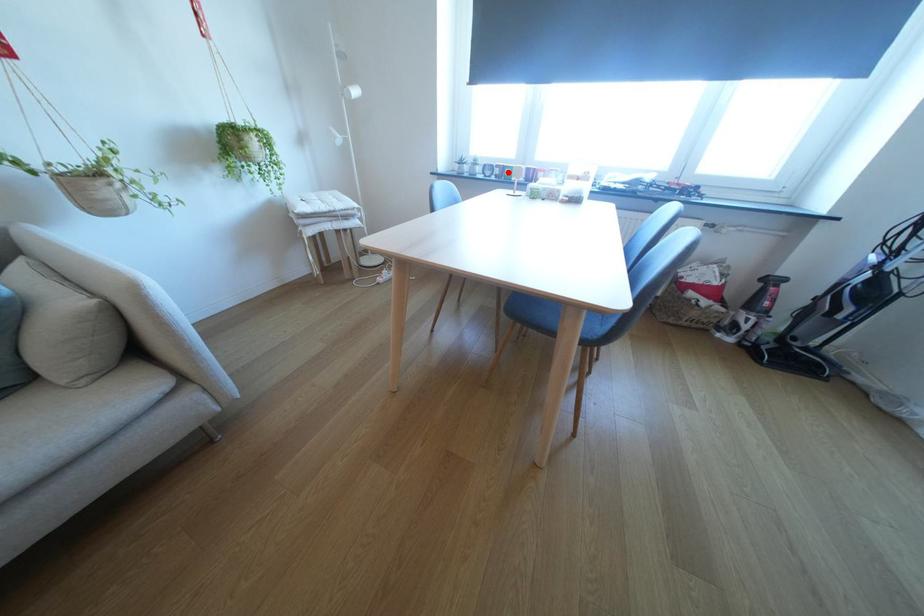
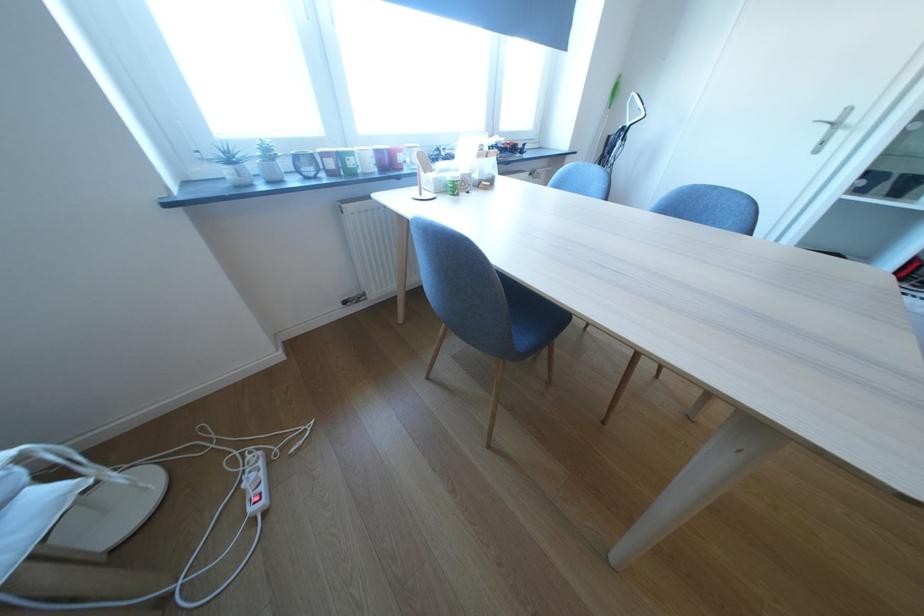
In the second image, find the point that corresponds to the highlighted location in the first image.

(342, 164)